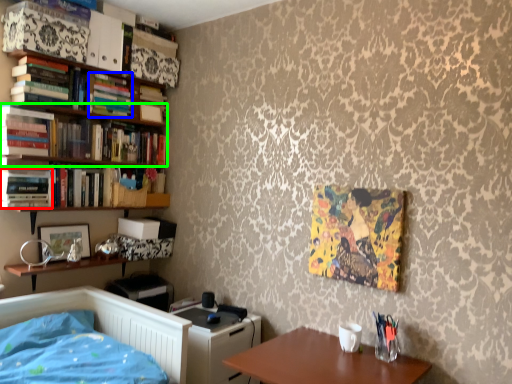
Question: Which object is the closest to the book (highlighted by a red box)? Choose among these: book (highlighted by a blue box) or book (highlighted by a green box).

Choices:
 (A) book
 (B) book

Answer: (B)